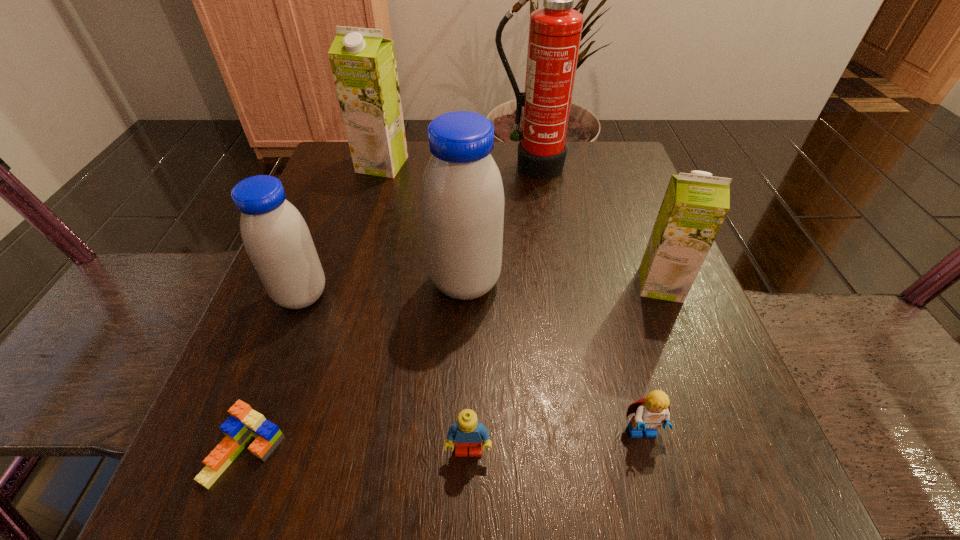
Locate an element on the screen. vacant space at the far edge of the desktop is located at coordinates (515, 148).

Locate an element on the screen. This screenshot has height=540, width=960. vacant area at the left edge is located at coordinates [x=342, y=213].

Where is `vacant space at the right edge`? Image resolution: width=960 pixels, height=540 pixels. vacant space at the right edge is located at coordinates (613, 257).

Find the location of a particular element. The height and width of the screenshot is (540, 960). free space at the far left corner is located at coordinates 331,167.

The width and height of the screenshot is (960, 540). In the image, there is a desktop. Find the location of `free space at the near left corner`. free space at the near left corner is located at coordinates [250, 456].

Where is `free spot at the far right corner of the desktop`? free spot at the far right corner of the desktop is located at coordinates (567, 147).

You are a GUI agent. You are given a task and a screenshot of the screen. Output one action in this format:
    pyautogui.click(x=<x>, y=<y>)
    Task: Click on the free space at the near right corner of the desktop
    
    Given the screenshot: What is the action you would take?
    pyautogui.click(x=743, y=510)

Locate an element on the screen. This screenshot has height=540, width=960. free space between the right green soya milk and the tallest object is located at coordinates (596, 225).

Locate an element on the screen. This screenshot has width=960, height=540. vacant area that lies between the red fire extinguisher and the left blue soya milk is located at coordinates (417, 231).

Where is `unoccupied area between the left blue soya milk and the shortest object`? The height and width of the screenshot is (540, 960). unoccupied area between the left blue soya milk and the shortest object is located at coordinates (274, 374).